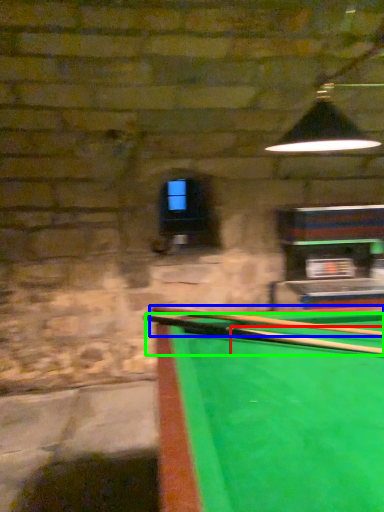
Question: Based on their relative distances, which object is farther from cue (highlighted by a red box)? Choose from cue (highlighted by a blue box) and cue (highlighted by a green box).

Choices:
 (A) cue
 (B) cue

Answer: (A)